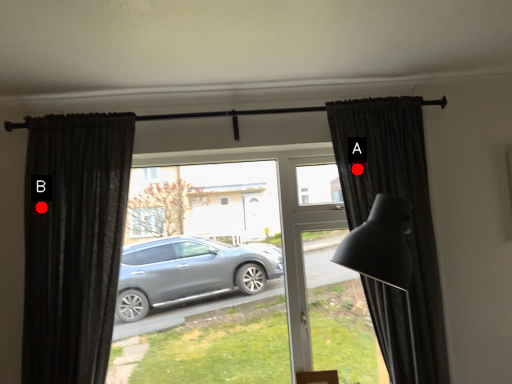
Question: Two points are circled on the image, labeled by A and B beside each circle. Which point appears farthest from the camera in this image?

Choices:
 (A) A is further
 (B) B is further

Answer: (A)